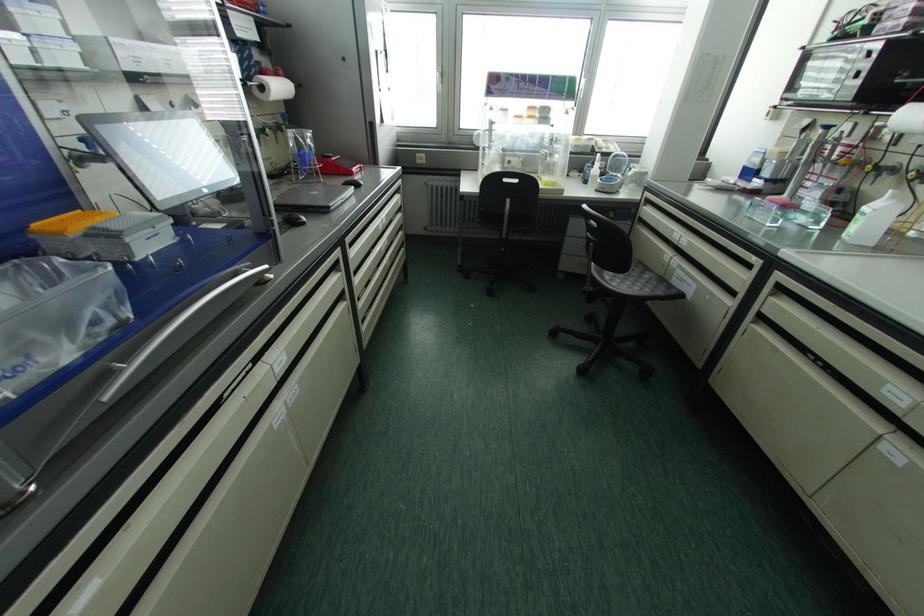
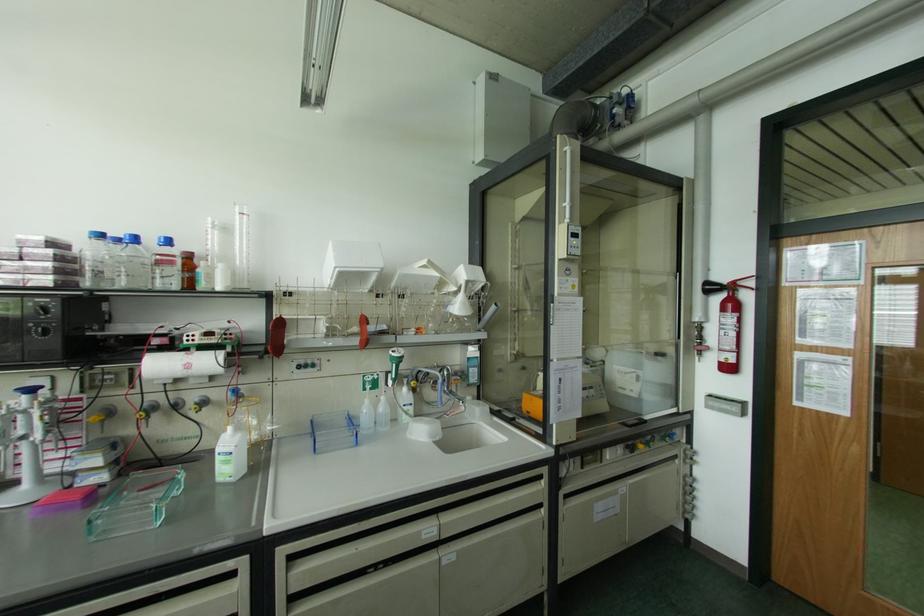
Where in the second image is the point corresponding to [878,175] from the first image?

(148, 416)